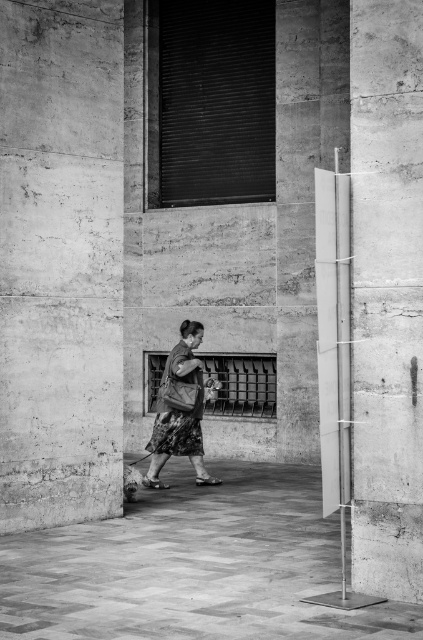
Question: Does polished stone pavement at lower center have a smaller size compared to concrete pillar at right?

Choices:
 (A) yes
 (B) no

Answer: (A)

Question: Among these objects, which one is farthest from the camera?

Choices:
 (A) smooth concrete pillar at left
 (B) floral skirt at center
 (C) polished stone pavement at lower center

Answer: (B)

Question: Observing the image, what is the correct spatial positioning of polished stone pavement at lower center in reference to concrete pillar at right?

Choices:
 (A) above
 (B) below

Answer: (B)

Question: In this image, where is smooth concrete pillar at left located relative to polished stone pavement at lower center?

Choices:
 (A) right
 (B) left

Answer: (A)

Question: Estimate the real-world distances between objects in this image. Which object is farther from the smooth concrete pillar at left?

Choices:
 (A) polished stone pavement at lower center
 (B) floral skirt at center

Answer: (A)

Question: Which object is positioned farthest from the polished stone pavement at lower center?

Choices:
 (A) smooth concrete pillar at left
 (B) concrete pillar at right

Answer: (B)